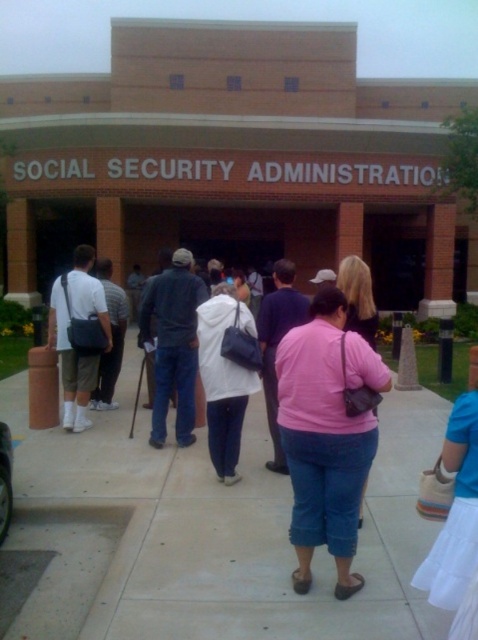
Who is more distant from viewer, (322,340) or (85,365)?

The point (85,365) is more distant.

Can you confirm if pink matte shirt at center is positioned above white matte shirt at center?

No.

Who is more distant from viewer, (304, 561) or (79, 401)?

The point (79, 401) is behind.

Where is `pink matte shirt at center`? This screenshot has width=478, height=640. pink matte shirt at center is located at coordinates (326, 435).

Between cement sidewalk at center and white matte shirt at center, which one has more height?

white matte shirt at center is taller.

At what (x,y) coordinates should I click in order to perform the action: click on cement sidewalk at center. Please return your answer as a coordinate pair (x, y). Looking at the image, I should click on (209, 532).

Where is `cement sidewalk at center`? cement sidewalk at center is located at coordinates (209, 532).

Measure the distance from cement sidewalk at center to pink matte shirt at center.

They are 3.98 feet apart.

Based on the photo, is the position of cement sidewalk at center more distant than that of pink matte shirt at center?

Yes, it is behind pink matte shirt at center.

Between point (116, 592) and point (293, 385), which one is positioned behind?

Positioned behind is point (116, 592).

Where is `cement sidewalk at center`? Image resolution: width=478 pixels, height=640 pixels. cement sidewalk at center is located at coordinates (209, 532).